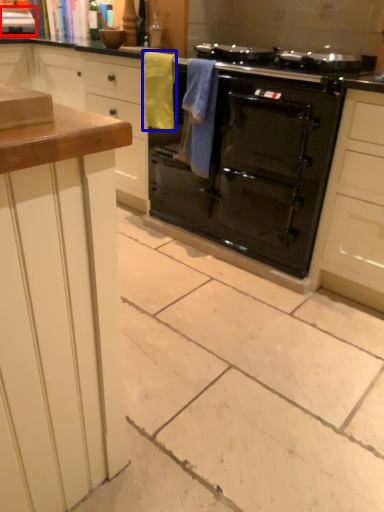
Question: Which object appears closest to the camera in this image, appliance (highlighted by a red box) or material (highlighted by a blue box)?

Choices:
 (A) appliance
 (B) material

Answer: (B)